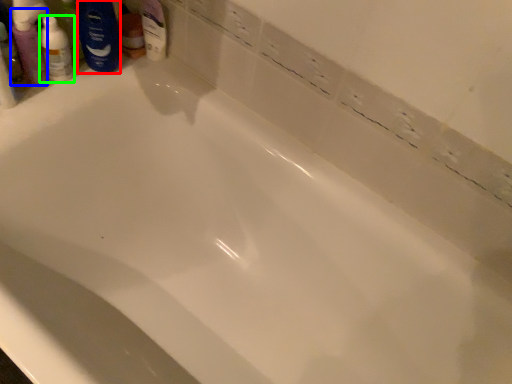
Question: Which object is positioned closest to shaving cream (highlighted by a red box)? Select from mouthwash (highlighted by a blue box) and toiletry (highlighted by a green box).

Choices:
 (A) mouthwash
 (B) toiletry

Answer: (B)